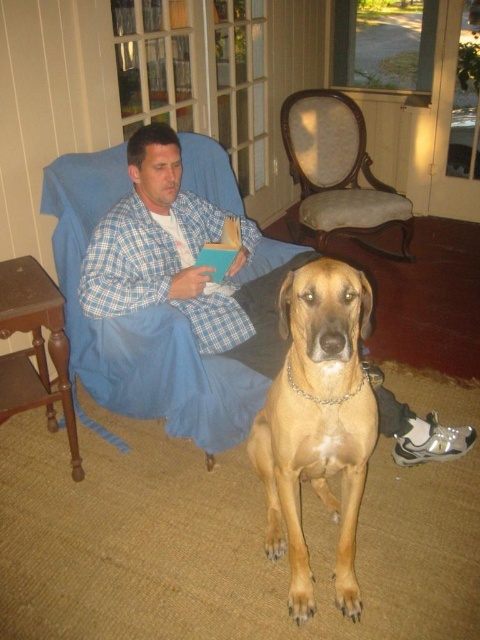
This screenshot has height=640, width=480. What do you see at coordinates (184, 260) in the screenshot? I see `plaid pajama at center` at bounding box center [184, 260].

Is point (199, 284) more distant than point (393, 211)?

No, (199, 284) is closer to viewer.

The image size is (480, 640). I want to click on plaid pajama at center, so click(184, 260).

Does plaid pajama at center appear on the left side of golden fur dog at center?

Correct, you'll find plaid pajama at center to the left of golden fur dog at center.

Does plaid pajama at center have a larger size compared to golden fur dog at center?

Yes, plaid pajama at center is bigger than golden fur dog at center.

Does point (167, 205) come closer to viewer compared to point (348, 356)?

No.

Identify the location of plaid pajama at center. This screenshot has height=640, width=480. click(x=184, y=260).

Can you confirm if golden fur dog at center is thinner than light brown fabric armchair at upper center?

Correct, golden fur dog at center's width is less than light brown fabric armchair at upper center's.

What do you see at coordinates (317, 422) in the screenshot? I see `golden fur dog at center` at bounding box center [317, 422].

Between point (279, 300) and point (296, 102), which one is positioned behind?

Positioned behind is point (296, 102).

Find the location of a particular element. This screenshot has height=640, width=480. golden fur dog at center is located at coordinates (317, 422).